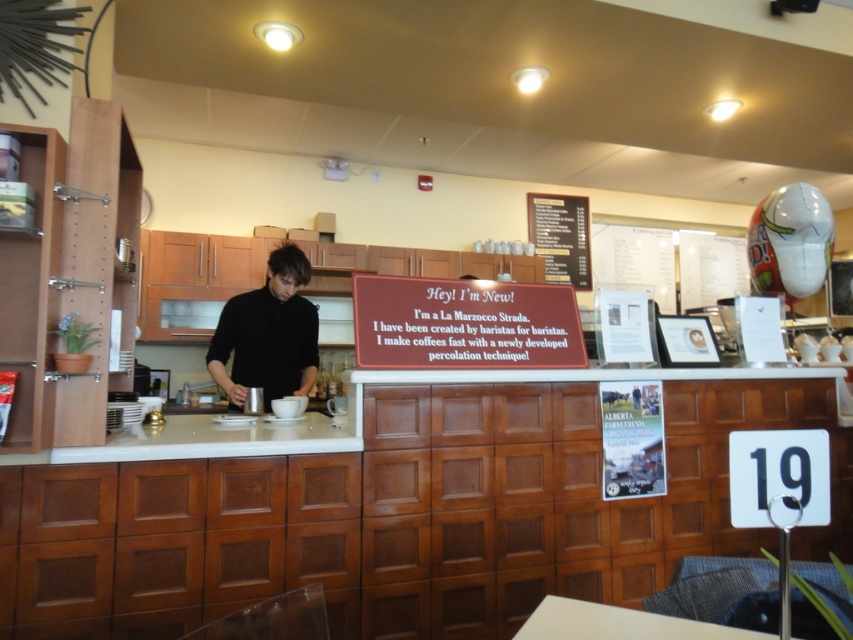
Question: Can you confirm if white laminate counter at center is positioned to the right of white paper menu at upper right?

Choices:
 (A) yes
 (B) no

Answer: (B)

Question: Which object appears closest to the camera in this image?

Choices:
 (A) black matte shirt at center
 (B) white paper menu at upper right
 (C) white laminate counter at center

Answer: (C)

Question: Which object appears farthest from the camera in this image?

Choices:
 (A) white laminate counter at center
 (B) white paper menu at upper right
 (C) black matte shirt at center

Answer: (B)

Question: Which point is closer to the camera?

Choices:
 (A) white paper menu at upper right
 (B) white laminate counter at center

Answer: (B)

Question: Does black matte shirt at center have a lesser width compared to white paper menu at upper right?

Choices:
 (A) no
 (B) yes

Answer: (B)

Question: Does white laminate counter at center appear on the left side of white paper menu at upper right?

Choices:
 (A) yes
 (B) no

Answer: (A)